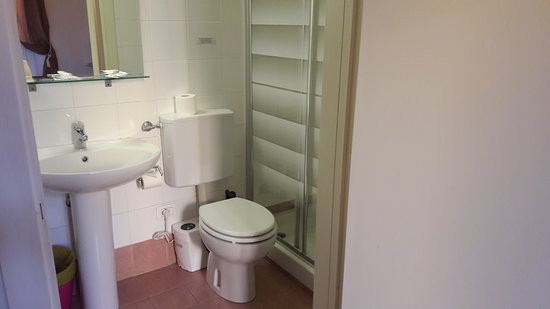
Where is `switchboard`? switchboard is located at coordinates (170, 212).